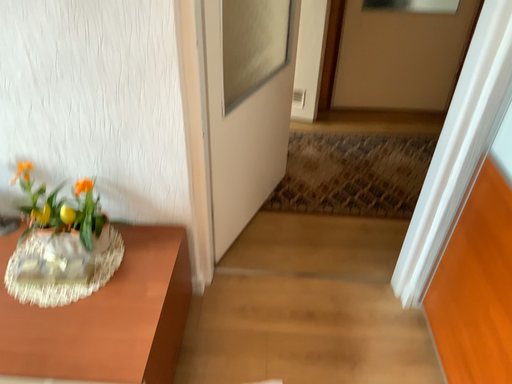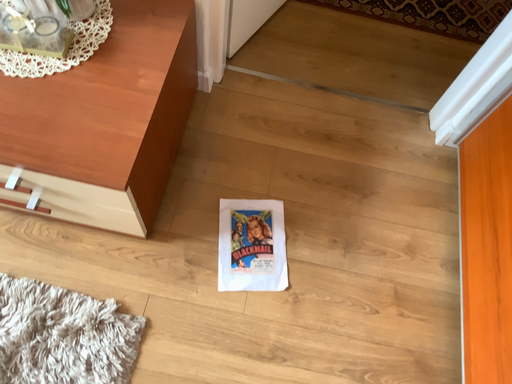
Question: Which way did the camera rotate in the video?

Choices:
 (A) rotated upward
 (B) rotated downward

Answer: (B)